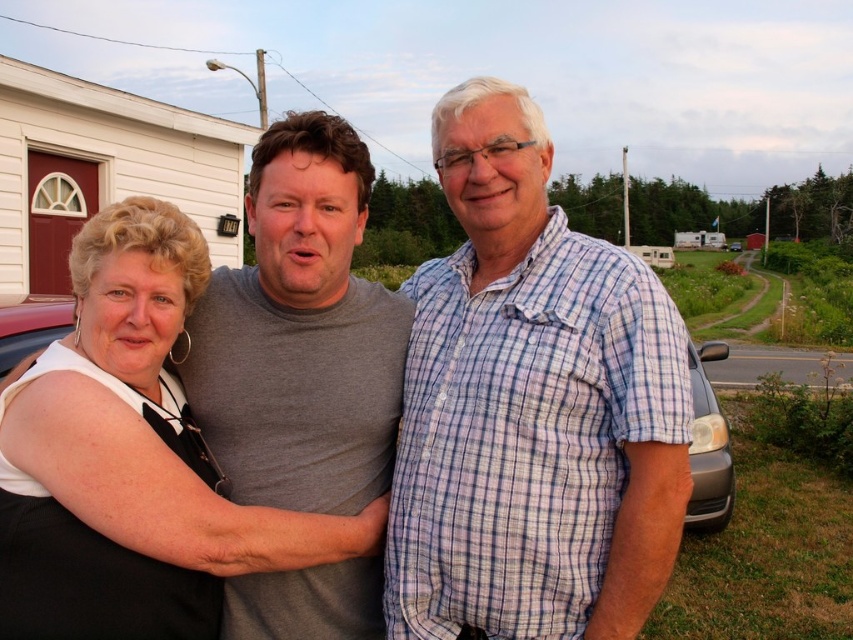
In the scene shown: Which is above, matte gray shirt at center or matte black dress at center?

matte gray shirt at center is above.

Is matte gray shirt at center shorter than matte black dress at center?

No, matte gray shirt at center is not shorter than matte black dress at center.

Find the location of a particular element. This screenshot has width=853, height=640. matte gray shirt at center is located at coordinates (531, 406).

This screenshot has height=640, width=853. Identify the location of matte gray shirt at center. (531, 406).

Between matte gray shirt at center and plaid cotton shirt at center, which one is positioned higher?

plaid cotton shirt at center is higher up.

Describe the element at coordinates (531, 406) in the screenshot. I see `matte gray shirt at center` at that location.

Between point (498, 136) and point (676, 346), which one is positioned in front?

Point (676, 346) is in front.

Image resolution: width=853 pixels, height=640 pixels. What are the coordinates of `matte gray shirt at center` in the screenshot? It's located at (531, 406).

Between plaid cotton shirt at center and matte black dress at center, which one has more height?

Standing taller between the two is plaid cotton shirt at center.

Can you confirm if plaid cotton shirt at center is shorter than matte black dress at center?

In fact, plaid cotton shirt at center may be taller than matte black dress at center.

Identify the location of plaid cotton shirt at center. The height and width of the screenshot is (640, 853). (531, 406).